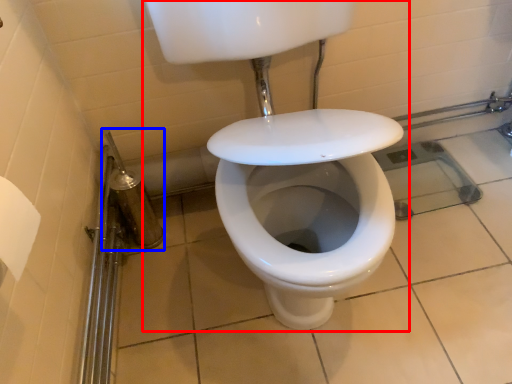
Question: Which point is further to the camera, sink (highlighted by a red box) or shower (highlighted by a blue box)?

Choices:
 (A) sink
 (B) shower

Answer: (B)